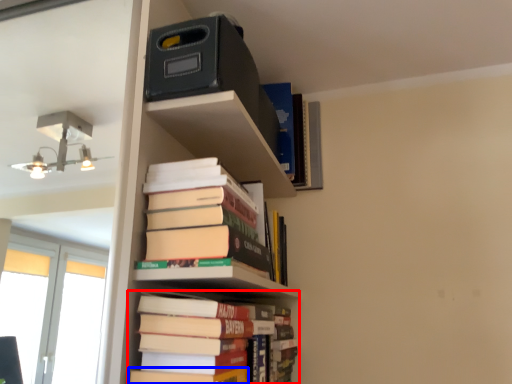
Question: Which object appears closest to the camera in this image, book (highlighted by a red box) or paperback book (highlighted by a blue box)?

Choices:
 (A) book
 (B) paperback book

Answer: (B)